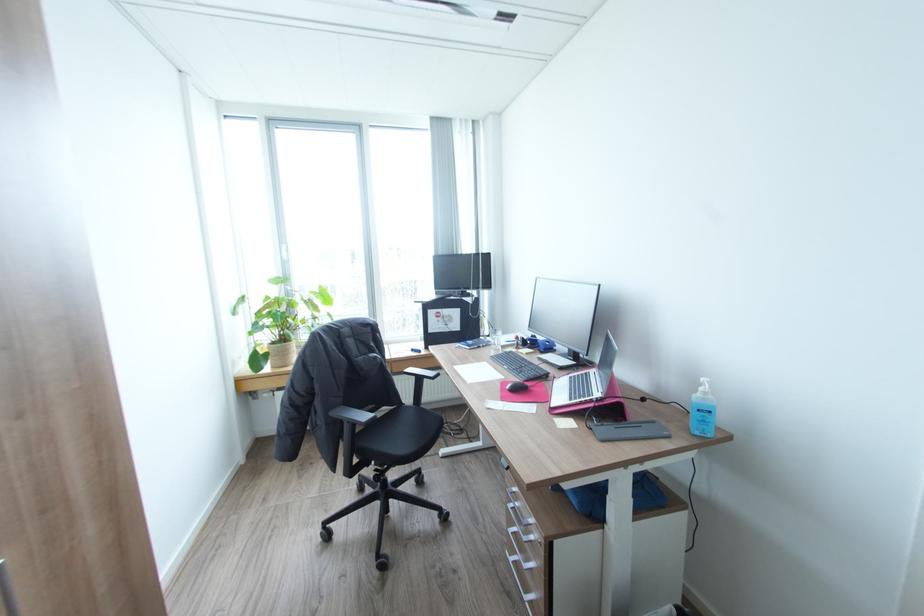
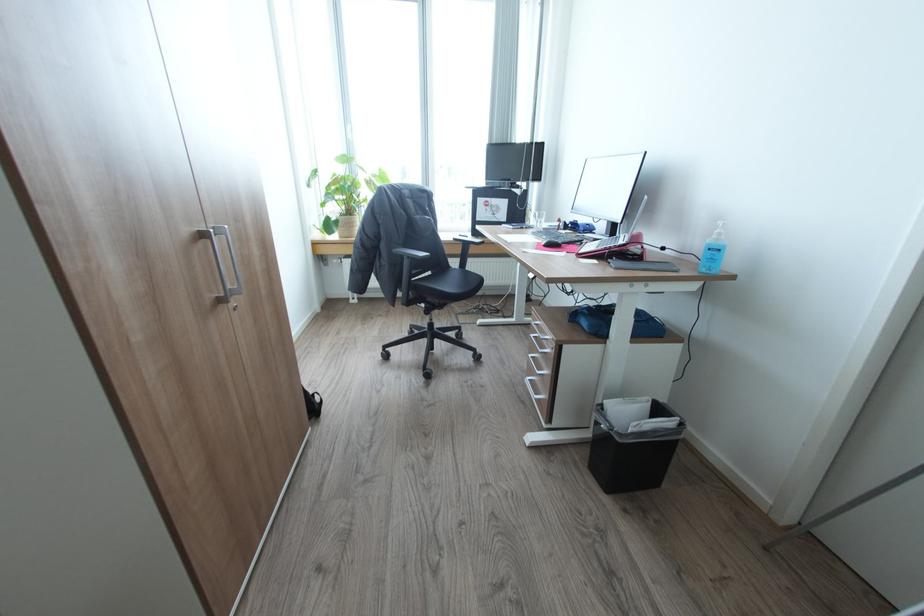
Question: The images are taken continuously from a first-person perspective. In which direction is your viewpoint rotating?

Choices:
 (A) Left
 (B) Right
 (C) Up
 (D) Down

Answer: (D)